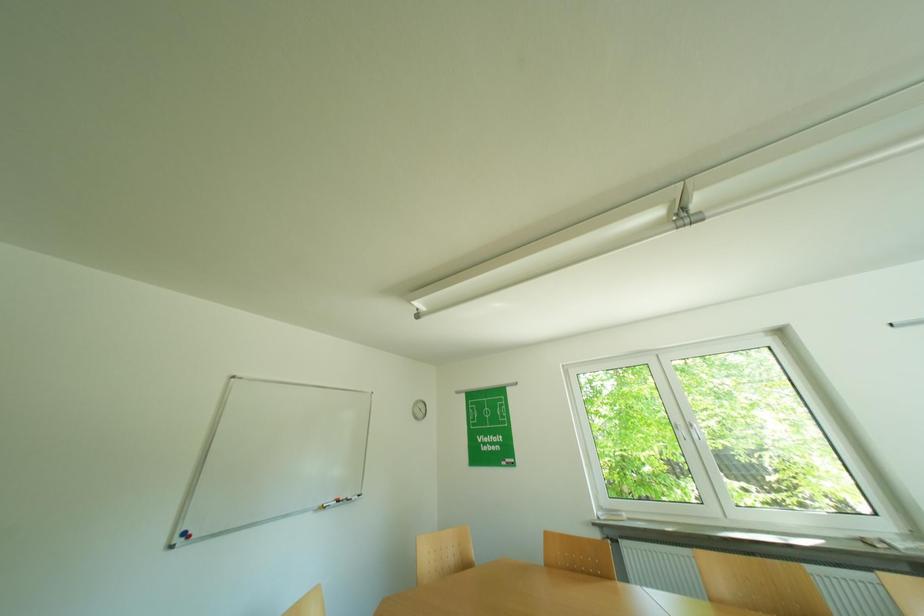
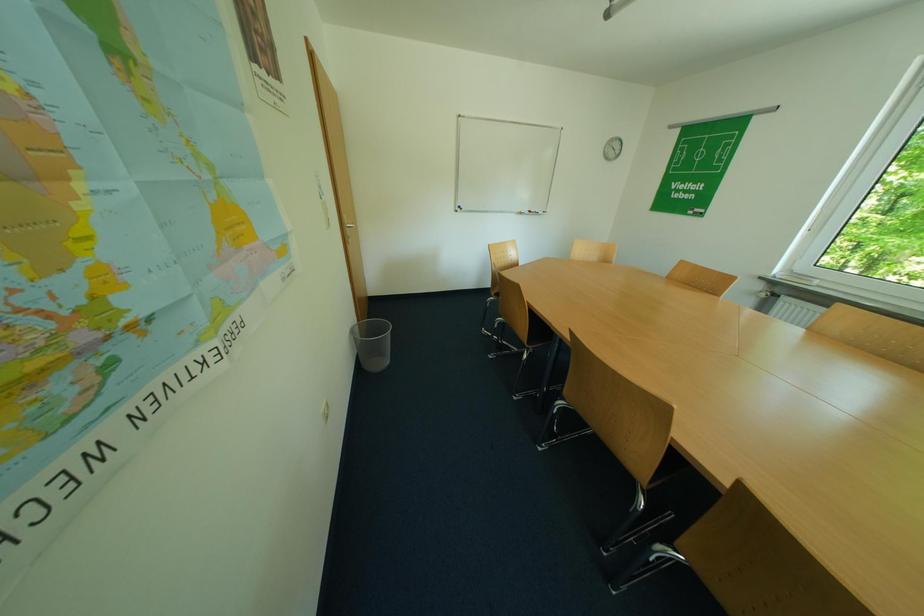
First-person continuous shooting, in which direction is the camera rotating?

The camera rotated toward left-down.